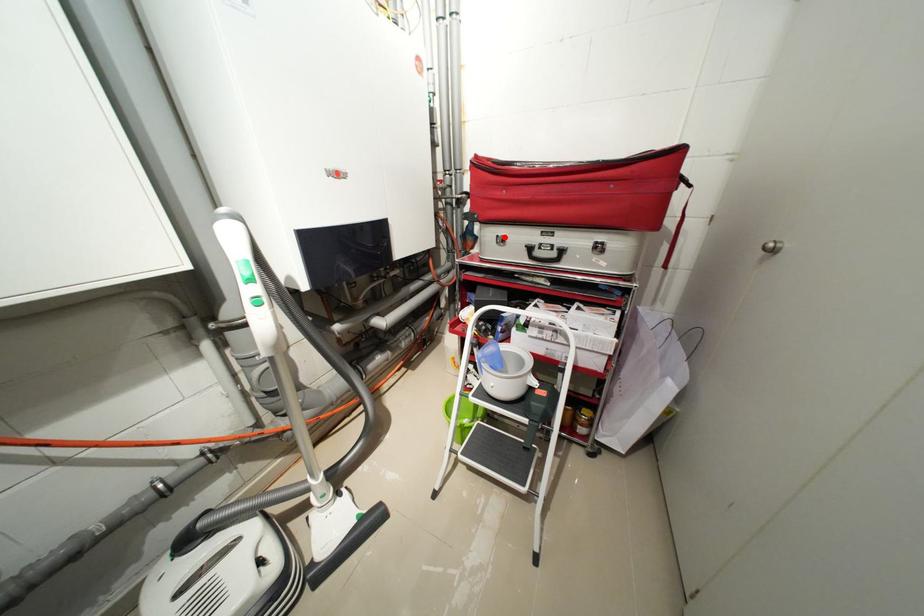
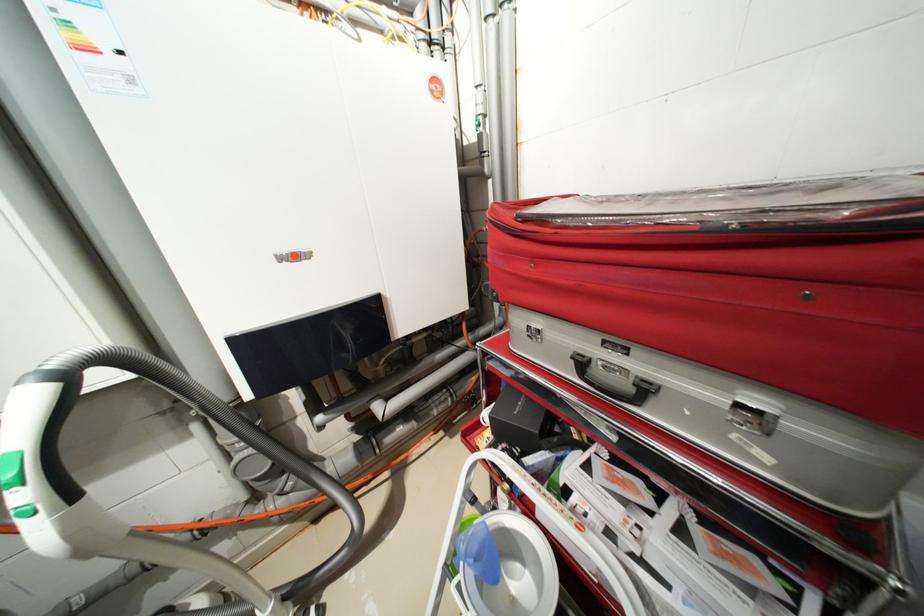
Where in the second image is the point corresponding to the highlighted location from the first image?

(536, 328)